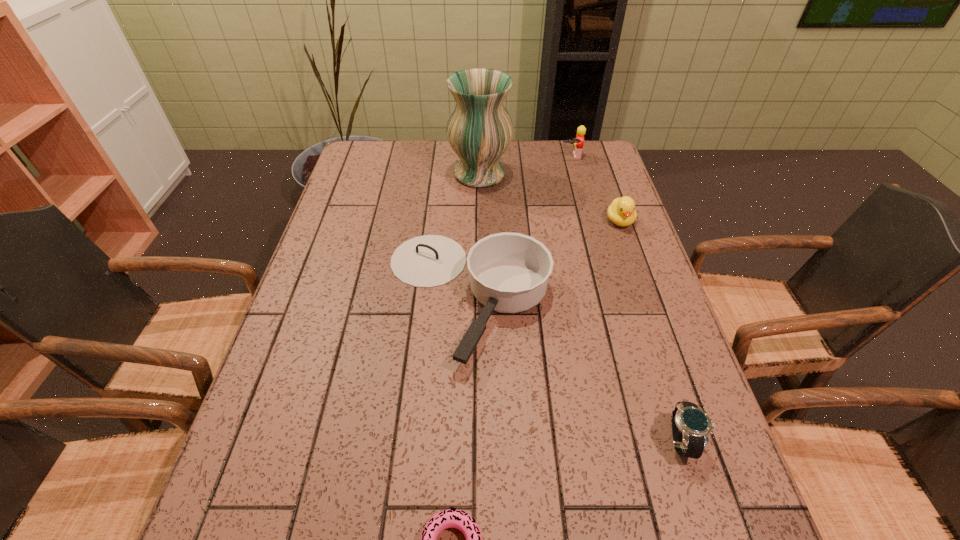
You are a GUI agent. You are given a task and a screenshot of the screen. Output one action in this format:
    pyautogui.click(x=<x>, y=<y>)
    Task: Click on the vase
    
    Given the screenshot: What is the action you would take?
    pyautogui.click(x=479, y=129)

Find the location of a particular element. This screenshot has height=540, width=960. Lego is located at coordinates (577, 142).

This screenshot has height=540, width=960. Identify the location of saucepan. (509, 272).

Locate an element on the screen. duckling is located at coordinates (621, 212).

Locate an element on the screen. watch is located at coordinates (691, 426).

Locate an element on the screen. The image size is (960, 540). free space located on the right of the tallest object is located at coordinates (593, 174).

The height and width of the screenshot is (540, 960). In order to click on free space located 0.070m in front of the second tallest object with the accessory visible in this screenshot , I will do `click(575, 173)`.

You are a GUI agent. You are given a task and a screenshot of the screen. Output one action in this format:
    pyautogui.click(x=<x>, y=<y>)
    Task: Click on the vacant position located 0.250m on the right of the saucepan
    The height and width of the screenshot is (540, 960).
    Given the screenshot: What is the action you would take?
    pyautogui.click(x=650, y=295)

Identify the location of free region located 0.380m on the beak of the duckling. This screenshot has width=960, height=540. [661, 340].

Find the location of a particular element. Image resolution: width=960 pixels, height=540 pixels. vacant space located 0.330m on the left of the fifth farthest object is located at coordinates (493, 440).